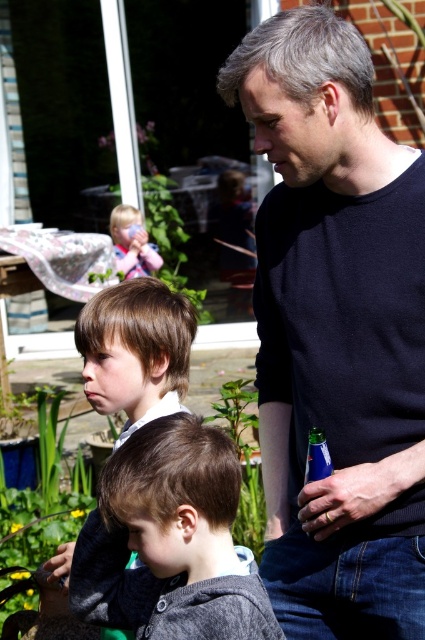
Is point (357, 592) positioned behind point (121, 516)?

Yes, point (357, 592) is farther from viewer.

This screenshot has width=425, height=640. Find the location of `dark blue sweater at center`. dark blue sweater at center is located at coordinates (336, 332).

Is point (158, 522) farther from camera compared to point (130, 317)?

No, (158, 522) is in front of (130, 317).

Is dark gray sweater at lower center to the left of brown hair at center from the viewer's perspective?

Incorrect, dark gray sweater at lower center is not on the left side of brown hair at center.

The height and width of the screenshot is (640, 425). I want to click on dark gray sweater at lower center, so click(170, 540).

Identify the location of dark gray sweater at lower center. (170, 540).

Which is behind, point (144, 129) or point (147, 266)?

The point (144, 129) is behind.

Based on the photo, between green leafy plant at upper left and matte pink toy at center, which one is positioned lower?

Positioned lower is matte pink toy at center.

The height and width of the screenshot is (640, 425). In order to click on green leafy plant at upper left in this screenshot , I will do `click(166, 224)`.

What are the coordinates of `green leafy plant at upper left` in the screenshot? It's located at (166, 224).